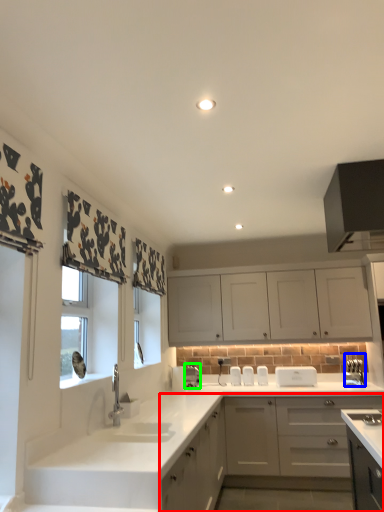
Question: Which is nearer to the cabinetry (highlighted by a red box)? appliance (highlighted by a blue box) or appliance (highlighted by a green box).

Choices:
 (A) appliance
 (B) appliance

Answer: (A)